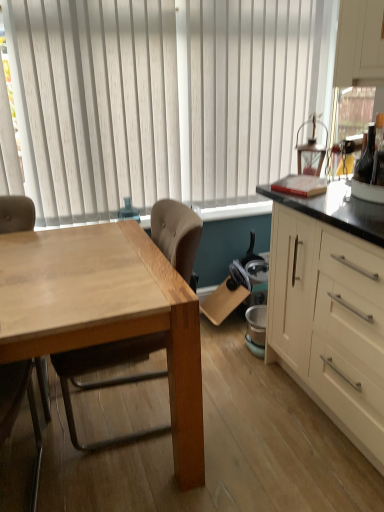
Locate an element on the screen. unoccupied region to the right of light brown wood chair at left, acting as the first chair starting from the right is located at coordinates (256, 415).